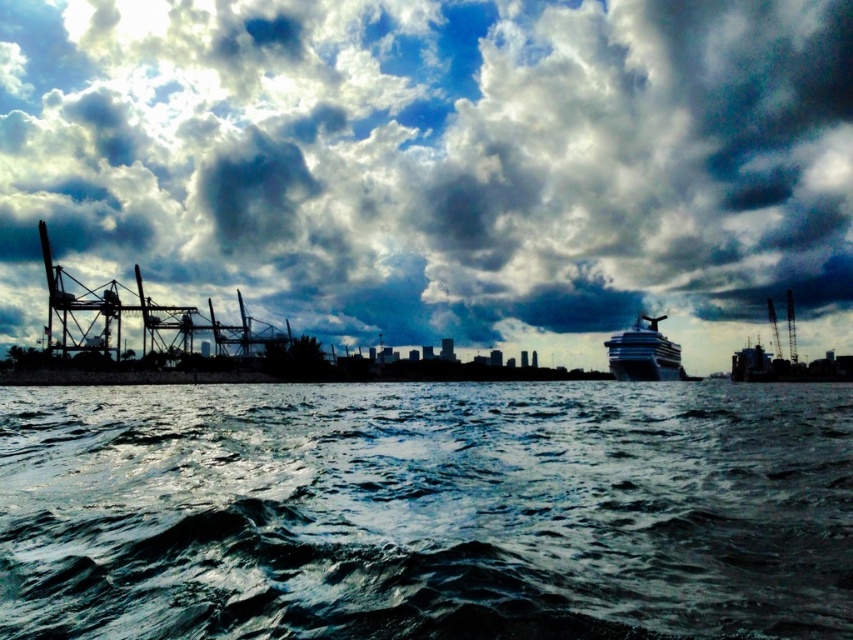
Question: Estimate the real-world distances between objects in this image. Which object is closer to the cloudy sky at upper center?

Choices:
 (A) white glossy cruise ship at right
 (B) dark blue water at lower center

Answer: (A)

Question: Which point appears farthest from the camera in this image?

Choices:
 (A) (535, 445)
 (B) (619, 371)

Answer: (B)

Question: Is cloudy sky at upper center closer to the viewer compared to dark blue water at lower center?

Choices:
 (A) yes
 (B) no

Answer: (B)

Question: Among these objects, which one is farthest from the camera?

Choices:
 (A) dark blue water at lower center
 (B) cloudy sky at upper center

Answer: (B)

Question: Is cloudy sky at upper center to the right of dark blue water at lower center from the viewer's perspective?

Choices:
 (A) yes
 (B) no

Answer: (A)

Question: Can you confirm if cloudy sky at upper center is positioned above white glossy cruise ship at right?

Choices:
 (A) no
 (B) yes

Answer: (B)